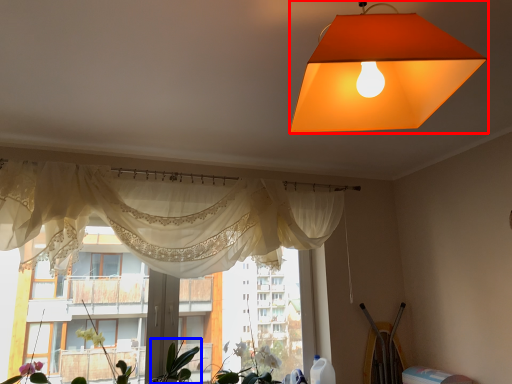
Question: Among these objects, which one is farthest to the camera, lamp (highlighted by a red box) or plant (highlighted by a blue box)?

Choices:
 (A) lamp
 (B) plant

Answer: (B)